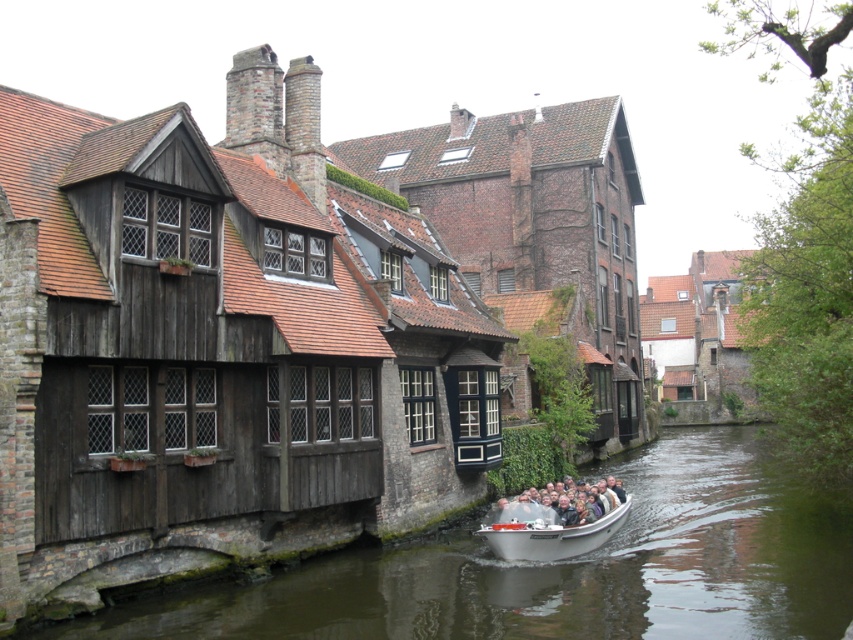
Question: Can you confirm if greenish water at center is wider than white plastic boat at center?

Choices:
 (A) yes
 (B) no

Answer: (A)

Question: Does greenish water at center appear under white plastic boat at center?

Choices:
 (A) no
 (B) yes

Answer: (B)

Question: Considering the relative positions of greenish water at center and white plastic boat at center in the image provided, where is greenish water at center located with respect to white plastic boat at center?

Choices:
 (A) below
 (B) above

Answer: (A)

Question: Among these points, which one is farthest from the camera?

Choices:
 (A) (125, 628)
 (B) (573, 497)

Answer: (B)

Question: Which object is farther from the camera taking this photo?

Choices:
 (A) white plastic boat at center
 (B) greenish water at center

Answer: (A)

Question: Among these objects, which one is farthest from the camera?

Choices:
 (A) white plastic boat at center
 (B) greenish water at center

Answer: (A)